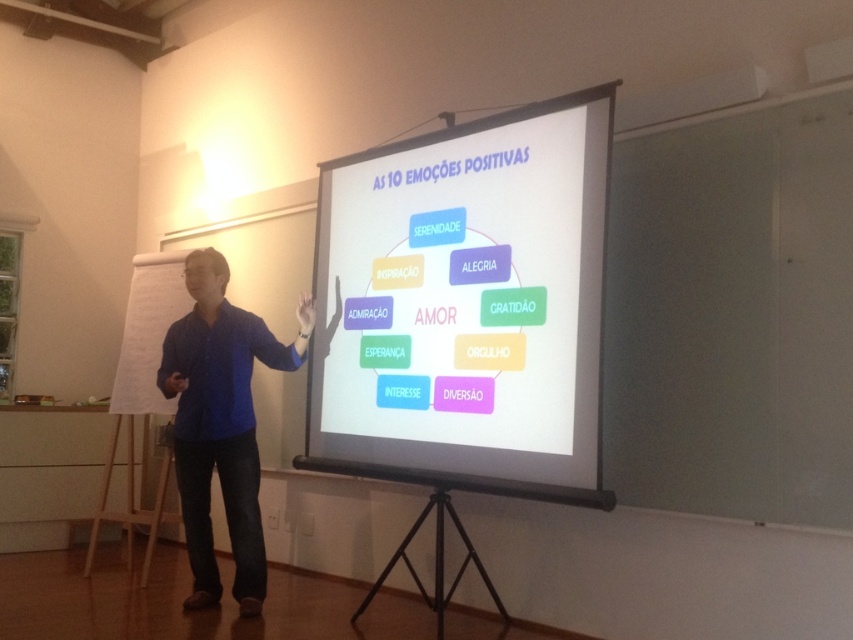
Question: Can you confirm if white matte projection screen at center is thinner than blue shirt at center?

Choices:
 (A) yes
 (B) no

Answer: (B)

Question: Which point is farther from the camera taking this photo?

Choices:
 (A) (526, 426)
 (B) (239, 387)

Answer: (B)

Question: Is white matte projection screen at center thinner than blue shirt at center?

Choices:
 (A) no
 (B) yes

Answer: (A)

Question: Considering the relative positions of white matte projection screen at center and blue shirt at center in the image provided, where is white matte projection screen at center located with respect to blue shirt at center?

Choices:
 (A) left
 (B) right

Answer: (B)